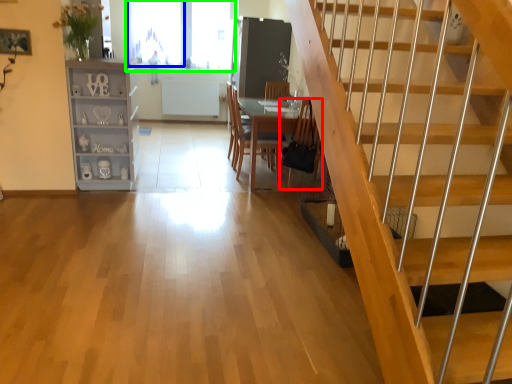
Question: Which is nearer to the armchair (highlighted by a red box)? window (highlighted by a blue box) or window (highlighted by a green box).

Choices:
 (A) window
 (B) window

Answer: (B)